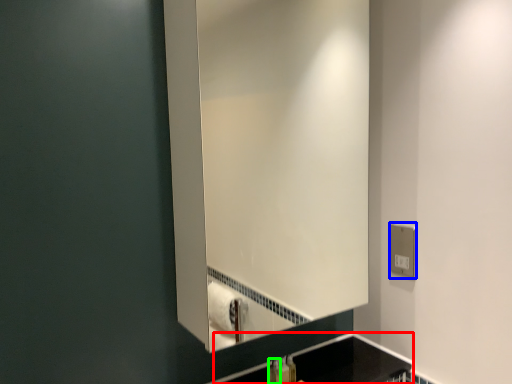
Question: Which is farther away from counter top (highlighted by a red box)? electric outlet (highlighted by a blue box) or toiletry (highlighted by a green box)?

Choices:
 (A) electric outlet
 (B) toiletry

Answer: (A)